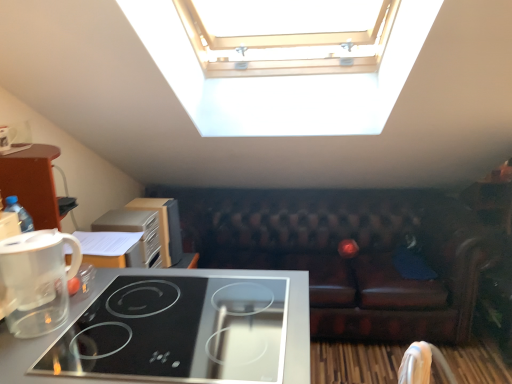
Find the location of a particular element. white fabric armchair at lower right is located at coordinates (416, 364).

Image resolution: width=512 pixels, height=384 pixels. What do you see at coordinates (164, 226) in the screenshot? I see `wooden cabinet at left, the 2th appliance positioned from the front` at bounding box center [164, 226].

What do you see at coordinates (347, 259) in the screenshot? The width and height of the screenshot is (512, 384). I see `brown leather couch at center` at bounding box center [347, 259].

The height and width of the screenshot is (384, 512). Find the location of `white fabric armchair at lower right`. white fabric armchair at lower right is located at coordinates (416, 364).

Who is taller, brown leather couch at center or satin silver toaster at upper left, the 2th appliance viewed from the back?

brown leather couch at center is taller.

Which object is wider, brown leather couch at center or satin silver toaster at upper left, the 2th appliance viewed from the back?

brown leather couch at center is wider.

Could you tell me if brown leather couch at center is turned towards satin silver toaster at upper left, the 2th appliance viewed from the back?

Yes, brown leather couch at center is facing satin silver toaster at upper left, the 2th appliance viewed from the back.

You are a GUI agent. You are given a task and a screenshot of the screen. Output one action in this format:
    pyautogui.click(x=<x>, y=<y>)
    Task: Click on the studio couch behind the satin silver toaster at upper left, the 2th appliance viewed from the back
    This screenshot has width=512, height=384.
    Given the screenshot: What is the action you would take?
    pyautogui.click(x=347, y=259)

Between satin silver toaster at upper left, which is the first appliance in front-to-back order, and transparent plastic coffee maker at lower left, which one appears on the right side from the viewer's perspective?

satin silver toaster at upper left, which is the first appliance in front-to-back order.

From a real-world perspective, does satin silver toaster at upper left, the 2th appliance viewed from the back, stand above transparent plastic coffee maker at lower left?

Actually, satin silver toaster at upper left, the 2th appliance viewed from the back, is physically below transparent plastic coffee maker at lower left in the real world.

Is satin silver toaster at upper left, which is the first appliance in front-to-back order, taller than transparent plastic coffee maker at lower left?

Yes.

Which of these two, satin silver toaster at upper left, which is the first appliance in front-to-back order, or transparent plastic coffee maker at lower left, is smaller?

transparent plastic coffee maker at lower left.

Considering the positions of point (44, 238) and point (418, 364), is point (44, 238) closer or farther from the camera than point (418, 364)?

Point (44, 238) is positioned closer to the camera compared to point (418, 364).

Is transparent plastic coffee maker at lower left to the right of white fabric armchair at lower right from the viewer's perspective?

Incorrect, transparent plastic coffee maker at lower left is not on the right side of white fabric armchair at lower right.

Does transparent plastic coffee maker at lower left have a smaller size compared to white fabric armchair at lower right?

No.

Where is `coffee maker above the white fabric armchair at lower right (from a real-world perspective)`? Image resolution: width=512 pixels, height=384 pixels. coffee maker above the white fabric armchair at lower right (from a real-world perspective) is located at coordinates (37, 280).

Does point (423, 381) appear closer or farther from the camera than point (174, 254)?

Point (423, 381).

How many degrees apart are the facing directions of white fabric armchair at lower right and wooden cabinet at left, marked as the first appliance in a back-to-front arrangement?

The angular difference between white fabric armchair at lower right and wooden cabinet at left, marked as the first appliance in a back-to-front arrangement, is 24.9 degrees.

Is white fabric armchair at lower right to the left or to the right of wooden cabinet at left, the 2th appliance positioned from the front, in the image?

In the image, white fabric armchair at lower right appears on the right side of wooden cabinet at left, the 2th appliance positioned from the front.

Which object is more forward, white fabric armchair at lower right or wooden cabinet at left, the 2th appliance positioned from the front?

white fabric armchair at lower right is closer to the camera.

Is brown leather couch at center surrounded by black glass cooktop at lower left?

That's incorrect, brown leather couch at center is not inside black glass cooktop at lower left.

Could you tell me if black glass cooktop at lower left is turned towards brown leather couch at center?

No, black glass cooktop at lower left is not facing towards brown leather couch at center.

Which is in front, point (308, 367) or point (213, 255)?

The point (308, 367) is in front.

From the image's perspective, is black glass cooktop at lower left below brown leather couch at center?

Yes, from the image's perspective, black glass cooktop at lower left is beneath brown leather couch at center.

Between wooden cabinet at left, marked as the first appliance in a back-to-front arrangement, and black glass cooktop at lower left, which one is positioned behind?

wooden cabinet at left, marked as the first appliance in a back-to-front arrangement.

Is wooden cabinet at left, the 2th appliance positioned from the front, to the right of black glass cooktop at lower left from the viewer's perspective?

No, wooden cabinet at left, the 2th appliance positioned from the front, is not to the right of black glass cooktop at lower left.

Consider the image. Considering the relative sizes of wooden cabinet at left, the 2th appliance positioned from the front, and black glass cooktop at lower left in the image provided, is wooden cabinet at left, the 2th appliance positioned from the front, bigger than black glass cooktop at lower left?

No, wooden cabinet at left, the 2th appliance positioned from the front, is not bigger than black glass cooktop at lower left.

Which is correct: black glass cooktop at lower left is inside satin silver toaster at upper left, the 2th appliance viewed from the back, or outside of it?

black glass cooktop at lower left is outside satin silver toaster at upper left, the 2th appliance viewed from the back.

Is point (0, 367) closer to camera compared to point (125, 261)?

Yes.

Does black glass cooktop at lower left have a greater width compared to satin silver toaster at upper left, the 2th appliance viewed from the back?

Indeed, black glass cooktop at lower left has a greater width compared to satin silver toaster at upper left, the 2th appliance viewed from the back.

Is black glass cooktop at lower left not close to satin silver toaster at upper left, the 2th appliance viewed from the back?

No, black glass cooktop at lower left is not far from satin silver toaster at upper left, the 2th appliance viewed from the back.

Image resolution: width=512 pixels, height=384 pixels. What are the coordinates of `studio couch that appears below the satin silver toaster at upper left, the 2th appliance viewed from the back (from the image's perspective)` in the screenshot? It's located at (347, 259).

From a real-world perspective, which appliance is the 1st one underneath the transparent plastic coffee maker at lower left? Please provide its 2D coordinates.

[(135, 231)]

From the image, which object appears to be farther from satin silver toaster at upper left, which is the first appliance in front-to-back order, black glass cooktop at lower left or transparent plastic coffee maker at lower left?

Among the two, transparent plastic coffee maker at lower left is located further to satin silver toaster at upper left, which is the first appliance in front-to-back order.

When comparing their distances from white fabric armchair at lower right, does satin silver toaster at upper left, the 2th appliance viewed from the back, or wooden cabinet at left, the 2th appliance positioned from the front, seem closer?

Among the two, satin silver toaster at upper left, the 2th appliance viewed from the back, is located nearer to white fabric armchair at lower right.

Which object lies nearer to the anchor point brown leather couch at center, transparent plastic coffee maker at lower left or white fabric armchair at lower right?

white fabric armchair at lower right is closer to brown leather couch at center.

Estimate the real-world distances between objects in this image. Which object is further from white fabric armchair at lower right, brown leather couch at center or satin silver toaster at upper left, the 2th appliance viewed from the back?

Among the two, brown leather couch at center is located further to white fabric armchair at lower right.

From the image, which object appears to be nearer to wooden cabinet at left, marked as the first appliance in a back-to-front arrangement, transparent plastic coffee maker at lower left or white fabric armchair at lower right?

Among the two, transparent plastic coffee maker at lower left is located nearer to wooden cabinet at left, marked as the first appliance in a back-to-front arrangement.

When comparing their distances from brown leather couch at center, does satin silver toaster at upper left, the 2th appliance viewed from the back, or wooden cabinet at left, the 2th appliance positioned from the front, seem closer?

Among the two, wooden cabinet at left, the 2th appliance positioned from the front, is located nearer to brown leather couch at center.

Looking at the image, which one is located closer to wooden cabinet at left, marked as the first appliance in a back-to-front arrangement, satin silver toaster at upper left, which is the first appliance in front-to-back order, or transparent plastic coffee maker at lower left?

Among the two, satin silver toaster at upper left, which is the first appliance in front-to-back order, is located nearer to wooden cabinet at left, marked as the first appliance in a back-to-front arrangement.

From the picture: When comparing their distances from white fabric armchair at lower right, does black glass cooktop at lower left or satin silver toaster at upper left, which is the first appliance in front-to-back order, seem further?

satin silver toaster at upper left, which is the first appliance in front-to-back order, lies further to white fabric armchair at lower right than the other object.

The image size is (512, 384). In order to click on studio couch between wooden cabinet at left, marked as the first appliance in a back-to-front arrangement, and white fabric armchair at lower right, in the horizontal direction in this screenshot , I will do `click(347, 259)`.

Find the location of a particular element. appliance situated between satin silver toaster at upper left, which is the first appliance in front-to-back order, and white fabric armchair at lower right from left to right is located at coordinates (164, 226).

Where is `armchair between black glass cooktop at lower left and wooden cabinet at left, the 2th appliance positioned from the front, from front to back`? The height and width of the screenshot is (384, 512). armchair between black glass cooktop at lower left and wooden cabinet at left, the 2th appliance positioned from the front, from front to back is located at coordinates (416, 364).

I want to click on armchair between black glass cooktop at lower left and brown leather couch at center from front to back, so click(x=416, y=364).